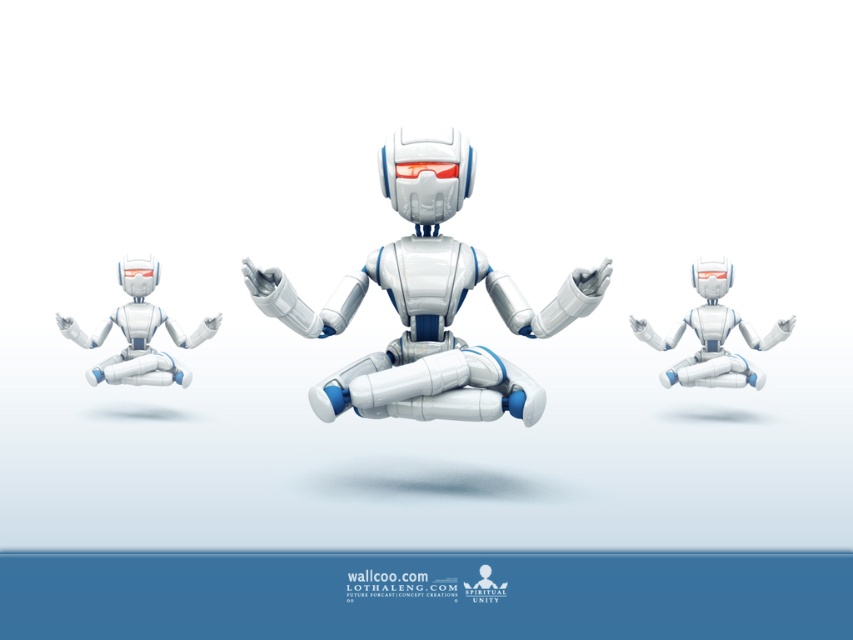
Does white glossy robot at center appear over white matte robot at left?

Correct, white glossy robot at center is located above white matte robot at left.

Is white glossy robot at center bigger than white matte robot at left?

Correct, white glossy robot at center is larger in size than white matte robot at left.

The width and height of the screenshot is (853, 640). In order to click on white glossy robot at center in this screenshot , I will do `click(427, 300)`.

This screenshot has height=640, width=853. Find the location of `white glossy robot at center`. white glossy robot at center is located at coordinates (427, 300).

Does white glossy robot at center appear over white matte robot at center?

Indeed, white glossy robot at center is positioned over white matte robot at center.

Which is more to the right, white glossy robot at center or white matte robot at center?

From the viewer's perspective, white matte robot at center appears more on the right side.

Where is `white glossy robot at center`? The width and height of the screenshot is (853, 640). white glossy robot at center is located at coordinates (427, 300).

Is point (786, 323) more distant than point (177, 362)?

That is False.

Can you confirm if white matte robot at center is thinner than white matte robot at left?

No, white matte robot at center is not thinner than white matte robot at left.

At what (x,y) coordinates should I click in order to perform the action: click on white matte robot at center. Please return your answer as a coordinate pair (x, y). The image size is (853, 640). Looking at the image, I should click on (712, 333).

This screenshot has height=640, width=853. What are the coordinates of `white matte robot at center` in the screenshot? It's located at (712, 333).